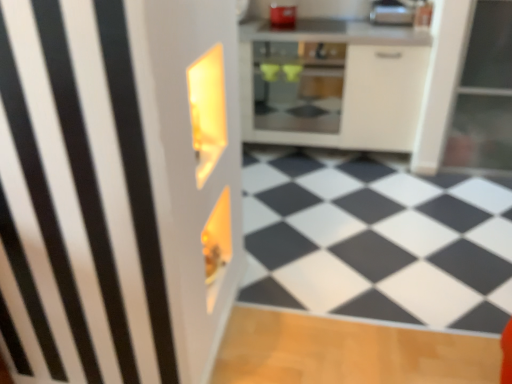
Question: Can you confirm if silver metallic toaster at upper right, the 2th appliance when ordered from left to right, is positioned to the left of white glossy cabinet at center?

Choices:
 (A) yes
 (B) no

Answer: (B)

Question: Considering the relative sizes of silver metallic toaster at upper right, which ranks as the first appliance in right-to-left order, and white glossy cabinet at center in the image provided, is silver metallic toaster at upper right, which ranks as the first appliance in right-to-left order, thinner than white glossy cabinet at center?

Choices:
 (A) yes
 (B) no

Answer: (A)

Question: Does silver metallic toaster at upper right, which ranks as the first appliance in right-to-left order, have a lesser height compared to white glossy cabinet at center?

Choices:
 (A) no
 (B) yes

Answer: (B)

Question: Considering the relative sizes of silver metallic toaster at upper right, which ranks as the first appliance in right-to-left order, and white glossy cabinet at center in the image provided, is silver metallic toaster at upper right, which ranks as the first appliance in right-to-left order, wider than white glossy cabinet at center?

Choices:
 (A) no
 (B) yes

Answer: (A)

Question: Choose the correct answer: Is metallic silver toaster at upper center, which is the second appliance in right-to-left order, inside silver metallic toaster at upper right, which ranks as the first appliance in right-to-left order, or outside it?

Choices:
 (A) inside
 (B) outside

Answer: (B)

Question: Is metallic silver toaster at upper center, which is the second appliance in right-to-left order, taller or shorter than silver metallic toaster at upper right, which ranks as the first appliance in right-to-left order?

Choices:
 (A) short
 (B) tall

Answer: (A)

Question: From the image's perspective, is metallic silver toaster at upper center, positioned as the 1th appliance in left-to-right order, positioned above or below silver metallic toaster at upper right, which ranks as the first appliance in right-to-left order?

Choices:
 (A) above
 (B) below

Answer: (A)

Question: In terms of size, does metallic silver toaster at upper center, which is the second appliance in right-to-left order, appear bigger or smaller than silver metallic toaster at upper right, which ranks as the first appliance in right-to-left order?

Choices:
 (A) small
 (B) big

Answer: (A)

Question: Considering their positions, is matte glass oven at center located in front of or behind metallic silver toaster at upper center, positioned as the 1th appliance in left-to-right order?

Choices:
 (A) front
 (B) behind

Answer: (A)

Question: Considering the positions of matte glass oven at center and metallic silver toaster at upper center, which is the second appliance in right-to-left order, in the image, is matte glass oven at center wider or thinner than metallic silver toaster at upper center, which is the second appliance in right-to-left order,?

Choices:
 (A) wide
 (B) thin

Answer: (A)

Question: Considering the positions of matte glass oven at center and metallic silver toaster at upper center, which is the second appliance in right-to-left order, in the image, is matte glass oven at center bigger or smaller than metallic silver toaster at upper center, which is the second appliance in right-to-left order,?

Choices:
 (A) small
 (B) big

Answer: (B)

Question: Considering the relative positions of matte glass oven at center and metallic silver toaster at upper center, positioned as the 1th appliance in left-to-right order, in the image provided, is matte glass oven at center to the left or to the right of metallic silver toaster at upper center, positioned as the 1th appliance in left-to-right order,?

Choices:
 (A) right
 (B) left

Answer: (A)

Question: Is silver metallic toaster at upper right, which ranks as the first appliance in right-to-left order, taller or shorter than white glossy cabinet at center?

Choices:
 (A) short
 (B) tall

Answer: (A)

Question: Is point (374, 19) closer or farther from the camera than point (323, 96)?

Choices:
 (A) farther
 (B) closer

Answer: (A)